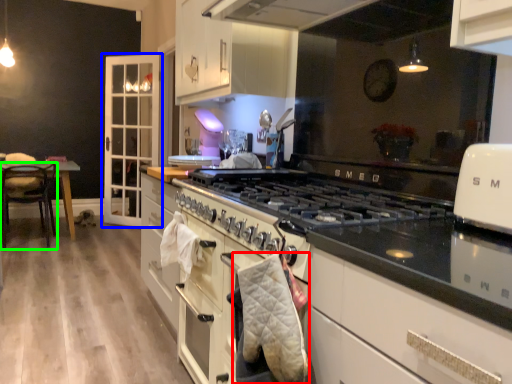
Question: Which is nearer to the blanket (highlighted by a red box)? cabinetry (highlighted by a blue box) or chair (highlighted by a green box).

Choices:
 (A) cabinetry
 (B) chair

Answer: (B)